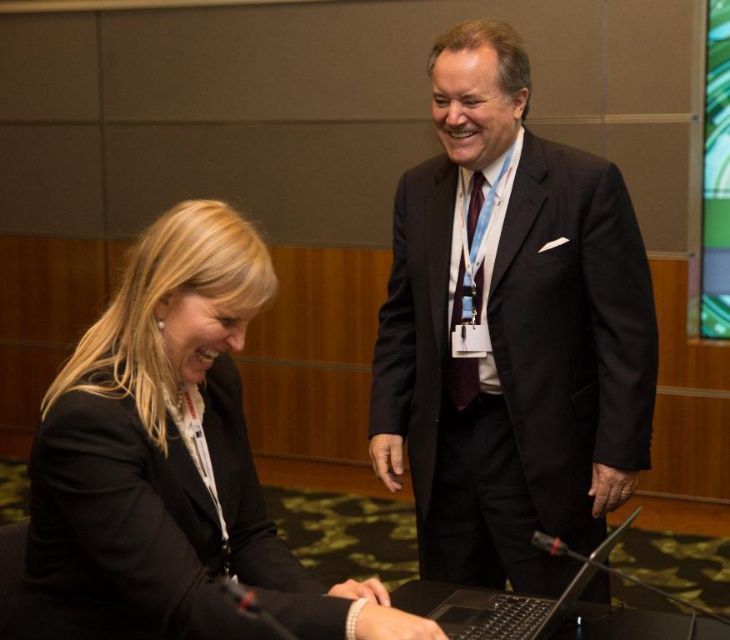
Question: Which object is the closest to the black matte suit at lower left?

Choices:
 (A) dark suit at center
 (B) black plastic laptop at lower center

Answer: (B)

Question: Which object is the closest to the dark suit at center?

Choices:
 (A) black matte suit at lower left
 (B) black plastic laptop at lower center

Answer: (B)

Question: Which object is positioned farthest from the black plastic laptop at lower center?

Choices:
 (A) black matte suit at lower left
 (B) dark suit at center

Answer: (B)

Question: Considering the relative positions of dark suit at center and black plastic laptop at lower center in the image provided, where is dark suit at center located with respect to black plastic laptop at lower center?

Choices:
 (A) left
 (B) right

Answer: (A)

Question: Is black matte suit at lower left bigger than black plastic laptop at lower center?

Choices:
 (A) no
 (B) yes

Answer: (B)

Question: Does black matte suit at lower left appear under black plastic laptop at lower center?

Choices:
 (A) yes
 (B) no

Answer: (B)